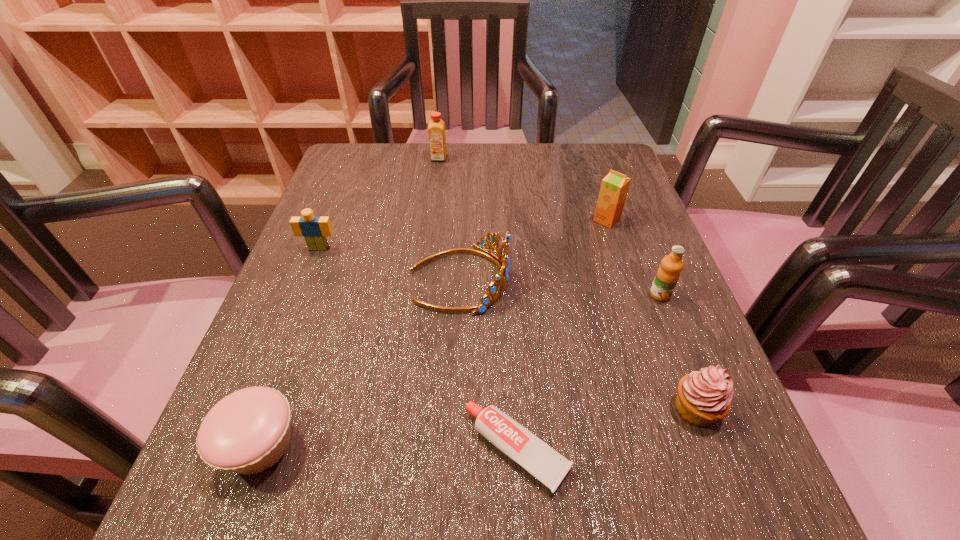
This screenshot has height=540, width=960. I want to click on vacant space that satisfies the following two spatial constraints: 1. on the back side of the toothpaste; 2. on the right side of the second orange juice from left to right, so click(x=503, y=220).

Identify the location of free space that satisfies the following two spatial constraints: 1. on the front and back of the second farthest object; 2. on the left side of the farthest object. (431, 220).

At what (x,y) coordinates should I click in order to perform the action: click on vacant point that satisfies the following two spatial constraints: 1. on the front and back of the leftmost orange juice; 2. on the left side of the second orange juice from right to left. Please return your answer as a coordinate pair (x, y). This screenshot has width=960, height=540. Looking at the image, I should click on (431, 220).

At what (x,y) coordinates should I click in order to perform the action: click on free space that satisfies the following two spatial constraints: 1. on the front and back of the second farthest object; 2. on the right side of the farthest object. Please return your answer as a coordinate pair (x, y). The height and width of the screenshot is (540, 960). Looking at the image, I should click on (431, 220).